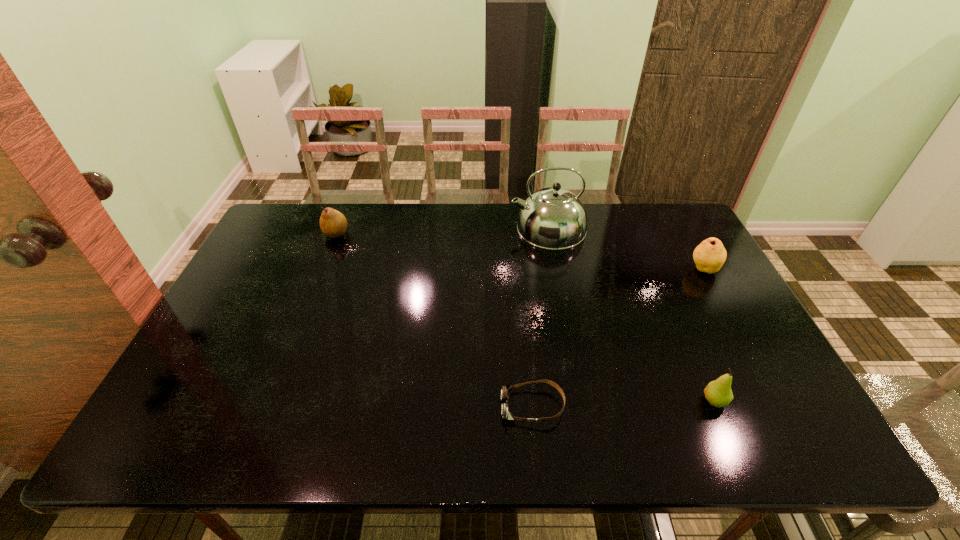
Find the location of a particular element. free point between the fourth object from left to right and the farthest pear is located at coordinates (525, 317).

Where is `vacant area between the rightmost object and the shortest object`? vacant area between the rightmost object and the shortest object is located at coordinates (618, 338).

Where is `vacant region between the leftmost object and the tallest object`? vacant region between the leftmost object and the tallest object is located at coordinates (442, 231).

Where is `empty location between the tallest object and the shortest object`? This screenshot has height=540, width=960. empty location between the tallest object and the shortest object is located at coordinates (540, 317).

Locate an element on the screen. The image size is (960, 540). vacant area that lies between the second pear from right to left and the kettle is located at coordinates (631, 314).

Where is `free space between the leftmost pear and the kettle`? free space between the leftmost pear and the kettle is located at coordinates (442, 231).

The width and height of the screenshot is (960, 540). I want to click on object that is the second closest one to the fourth object from left to right, so click(x=709, y=256).

Identify the location of object identified as the closest to the tallest object. Image resolution: width=960 pixels, height=540 pixels. (709, 256).

Select which pear is the closest to the goggles. Please provide its 2D coordinates. Your answer should be formatted as a tuple, i.e. [(x, y)], where the tuple contains the x and y coordinates of a point satisfying the conditions above.

[(718, 393)]

Identify which pear is the second closest to the rightmost object. Please provide its 2D coordinates. Your answer should be formatted as a tuple, i.e. [(x, y)], where the tuple contains the x and y coordinates of a point satisfying the conditions above.

[(333, 224)]